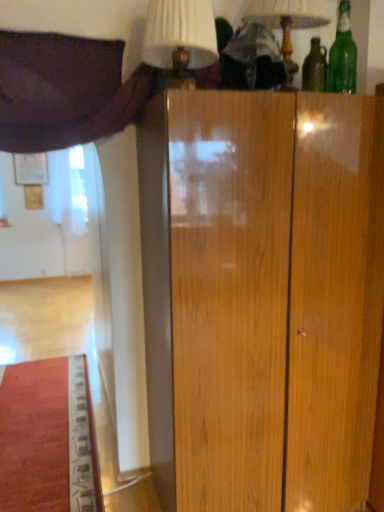
Question: Which direction should I rotate to look at matte white lampshade at upper center, which appears as the second table lamp when viewed from the left?

Choices:
 (A) left
 (B) right

Answer: (B)

Question: Is white fabric lampshade at upper center, which ranks as the 1th table lamp in left-to-right order, oriented away from green glass bottle at upper right?

Choices:
 (A) yes
 (B) no

Answer: (B)

Question: Is white fabric lampshade at upper center, the second table lamp positioned from the right, to the right of green glass bottle at upper right from the viewer's perspective?

Choices:
 (A) no
 (B) yes

Answer: (A)

Question: Can you confirm if white fabric lampshade at upper center, the second table lamp positioned from the right, is smaller than green glass bottle at upper right?

Choices:
 (A) yes
 (B) no

Answer: (B)

Question: Are white fabric lampshade at upper center, the second table lamp positioned from the right, and green glass bottle at upper right beside each other?

Choices:
 (A) yes
 (B) no

Answer: (B)

Question: Can you confirm if white fabric lampshade at upper center, which ranks as the 1th table lamp in left-to-right order, is bigger than green glass bottle at upper right?

Choices:
 (A) no
 (B) yes

Answer: (B)

Question: Is white fabric lampshade at upper center, which ranks as the 1th table lamp in left-to-right order, not near green glass bottle at upper right?

Choices:
 (A) no
 (B) yes

Answer: (A)

Question: Is matte white lampshade at upper center, arranged as the first table lamp when viewed from the right, thinner than green glass bottle at upper right?

Choices:
 (A) yes
 (B) no

Answer: (B)

Question: Is matte white lampshade at upper center, arranged as the first table lamp when viewed from the right, directly adjacent to green glass bottle at upper right?

Choices:
 (A) no
 (B) yes

Answer: (A)

Question: Is matte white lampshade at upper center, which appears as the second table lamp when viewed from the left, closer to camera compared to green glass bottle at upper right?

Choices:
 (A) yes
 (B) no

Answer: (A)

Question: Is matte white lampshade at upper center, which appears as the second table lamp when viewed from the left, positioned far away from green glass bottle at upper right?

Choices:
 (A) no
 (B) yes

Answer: (A)

Question: Is matte white lampshade at upper center, which appears as the second table lamp when viewed from the left, bigger than green glass bottle at upper right?

Choices:
 (A) yes
 (B) no

Answer: (A)

Question: Does matte white lampshade at upper center, which appears as the second table lamp when viewed from the left, have a greater height compared to green glass bottle at upper right?

Choices:
 (A) no
 (B) yes

Answer: (B)

Question: Is purple fabric curtain at upper left in contact with white fabric lampshade at upper center, the second table lamp positioned from the right?

Choices:
 (A) no
 (B) yes

Answer: (A)